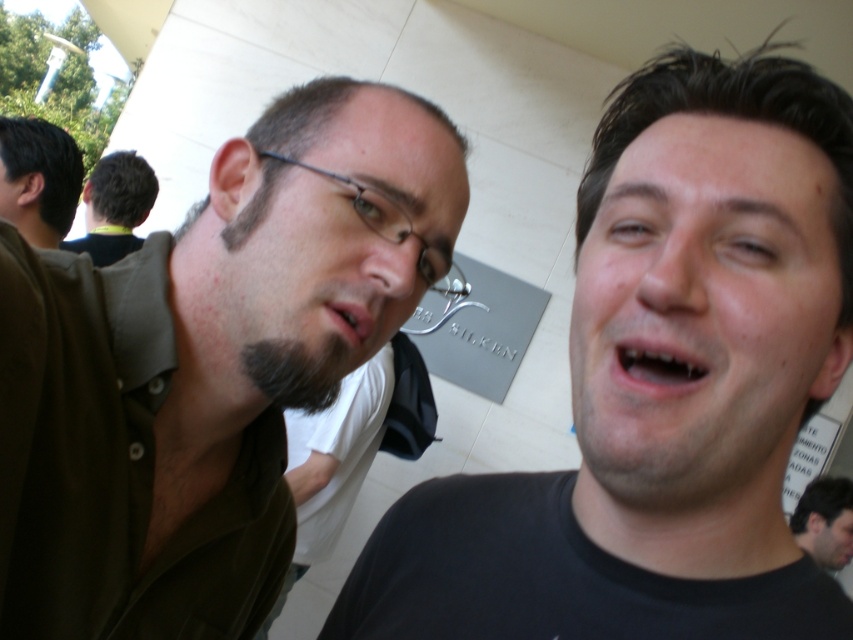
From the picture: Which is more to the right, dark brown hair at left or dark brown hair at lower right?

From the viewer's perspective, dark brown hair at lower right appears more on the right side.

Does dark brown hair at left appear over dark brown hair at lower right?

Yes.

Who is more forward, (85, 209) or (788, 522)?

Point (85, 209) is in front.

The height and width of the screenshot is (640, 853). Find the location of `dark brown hair at left`. dark brown hair at left is located at coordinates (114, 205).

Can you confirm if dark brown hair at lower right is positioned below pink glossy lips at center?

Correct, dark brown hair at lower right is located below pink glossy lips at center.

Is dark brown hair at lower right wider than pink glossy lips at center?

Indeed, dark brown hair at lower right has a greater width compared to pink glossy lips at center.

This screenshot has height=640, width=853. What do you see at coordinates (825, 522) in the screenshot?
I see `dark brown hair at lower right` at bounding box center [825, 522].

Find the location of a particular element. dark brown hair at lower right is located at coordinates (825, 522).

Does dark brown hair at left appear under smooth skin face at center?

No, dark brown hair at left is not below smooth skin face at center.

Between point (99, 170) and point (811, 541), which one is positioned behind?

The point (811, 541) is behind.

Locate an element on the screen. The width and height of the screenshot is (853, 640). dark brown hair at left is located at coordinates (114, 205).